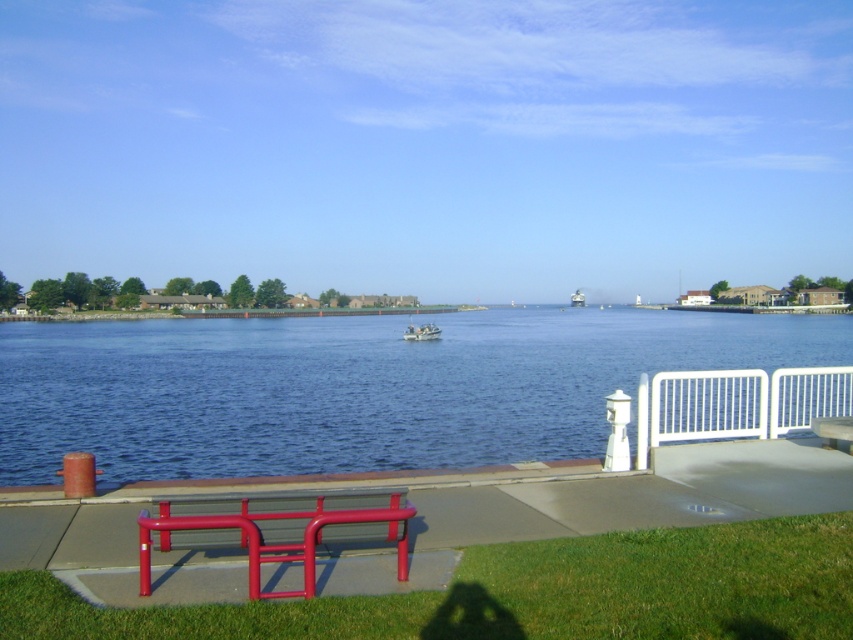
Who is positioned more to the right, white metal fence at right or white plastic boat at center?

white metal fence at right

Who is more distant from viewer, (704, 420) or (430, 330)?

The point (430, 330) is more distant.

I want to click on white metal fence at right, so click(735, 403).

What are the coordinates of `metallic red bench at lower left` in the screenshot? It's located at (276, 529).

Is metallic red bench at lower left shorter than white metal fence at right?

Yes, metallic red bench at lower left is shorter than white metal fence at right.

This screenshot has width=853, height=640. Describe the element at coordinates (276, 529) in the screenshot. I see `metallic red bench at lower left` at that location.

Locate an element on the screen. The height and width of the screenshot is (640, 853). metallic red bench at lower left is located at coordinates (276, 529).

You are a GUI agent. You are given a task and a screenshot of the screen. Output one action in this format:
    pyautogui.click(x=<x>, y=<y>)
    Task: Click on the white plastic boat at center
    The width and height of the screenshot is (853, 640).
    Given the screenshot: What is the action you would take?
    pyautogui.click(x=421, y=332)

Does white plastic boat at center appear under metallic gray boat at center?

Yes, white plastic boat at center is below metallic gray boat at center.

This screenshot has width=853, height=640. I want to click on white plastic boat at center, so click(421, 332).

Where is `white plastic boat at center`? white plastic boat at center is located at coordinates (421, 332).